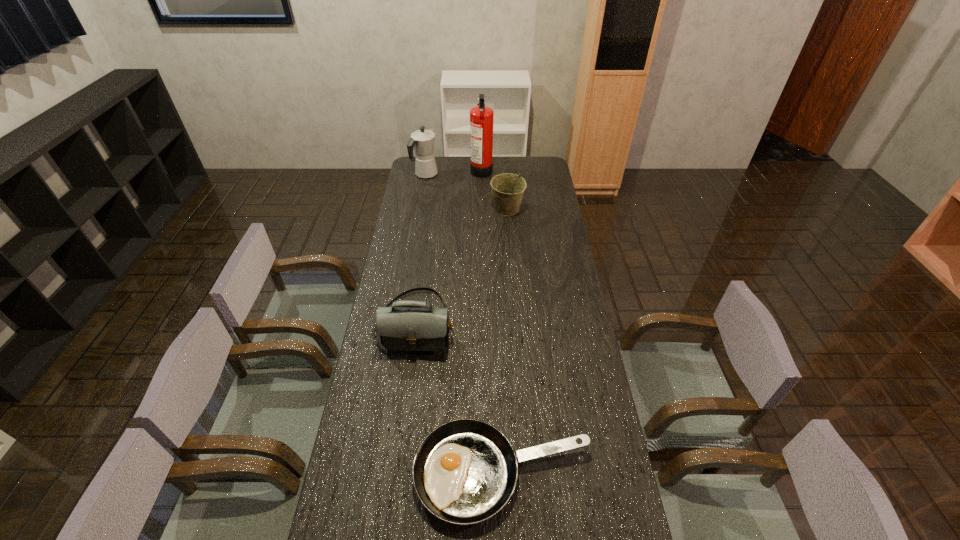
Where is `vacant space at the left edge`? vacant space at the left edge is located at coordinates (415, 192).

The width and height of the screenshot is (960, 540). Find the location of `free space at the right edge of the desktop`. free space at the right edge of the desktop is located at coordinates (568, 282).

Locate an element on the screen. The image size is (960, 540). vacant region at the far right corner is located at coordinates (548, 157).

You are a GUI agent. You are given a task and a screenshot of the screen. Output one action in this format:
    pyautogui.click(x=<x>, y=<y>)
    Task: Click on the free area in between the wine bucket and the shortest object
    
    Given the screenshot: What is the action you would take?
    pyautogui.click(x=505, y=341)

I want to click on free space that is in between the fire extinguisher and the fourth tallest object, so click(x=449, y=246).

Locate an element on the screen. This screenshot has height=540, width=960. free spot between the shoulder bag and the fire extinguisher is located at coordinates (449, 246).

The width and height of the screenshot is (960, 540). Find the location of `free space that is in between the nearest object and the coffeepot`. free space that is in between the nearest object and the coffeepot is located at coordinates (464, 324).

I want to click on vacant region between the frying pan and the coffeepot, so click(464, 324).

Select which object appears as the second closest to the coffeepot. Please provide its 2D coordinates. Your answer should be formatted as a tuple, i.e. [(x, y)], where the tuple contains the x and y coordinates of a point satisfying the conditions above.

[(508, 189)]

Image resolution: width=960 pixels, height=540 pixels. In order to click on object that can be found as the closest to the third farthest object in this screenshot , I will do `click(481, 117)`.